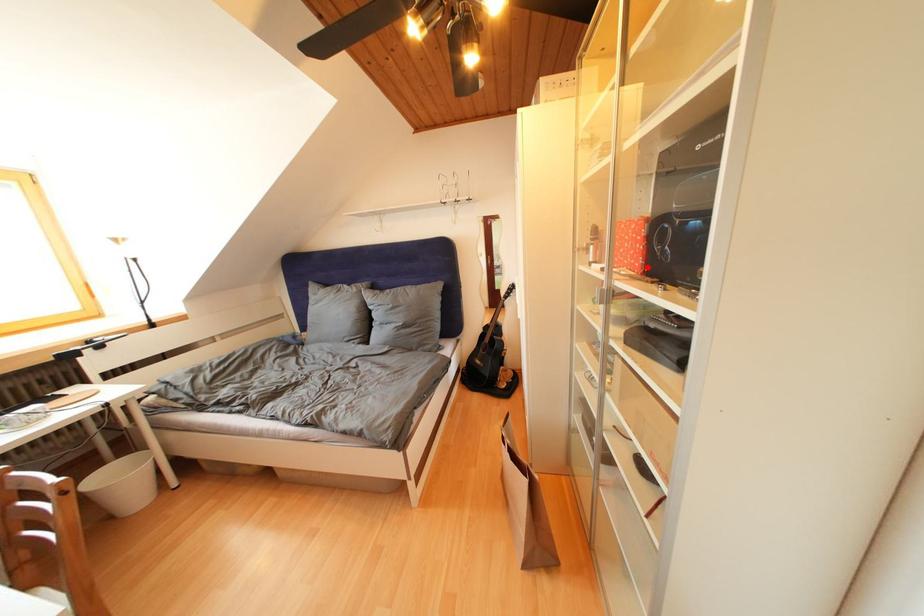
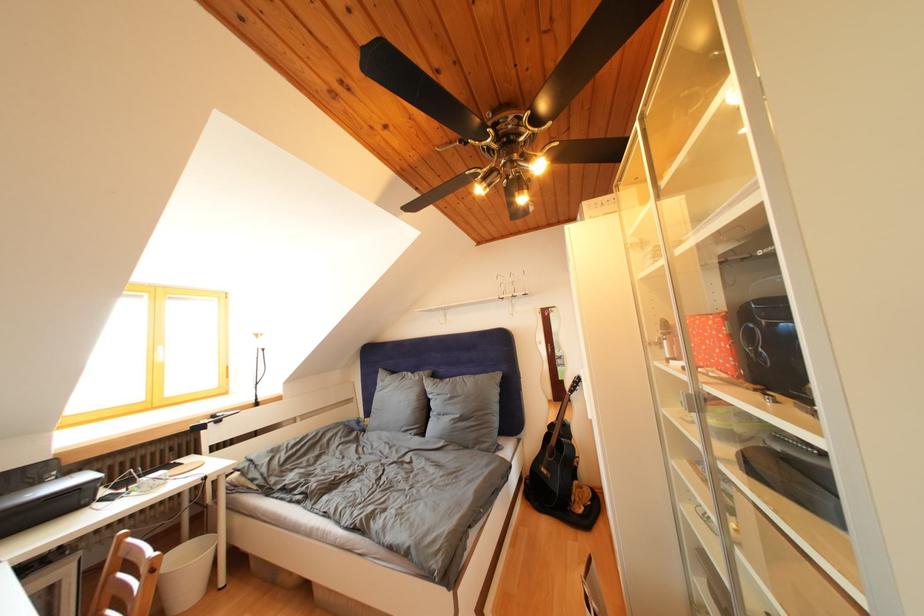
Find the pixel in the second image that matches the highlighted location in the first image.

(737, 368)